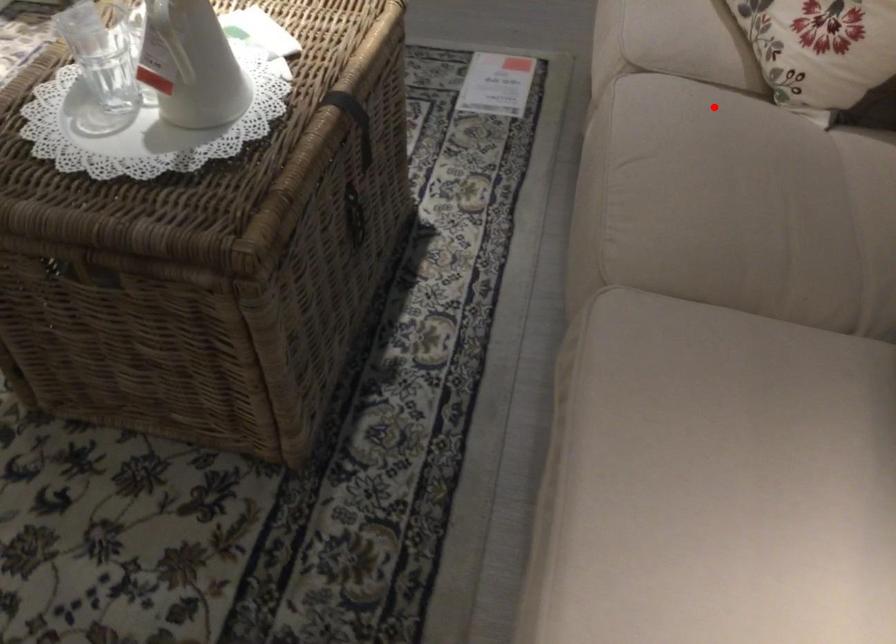
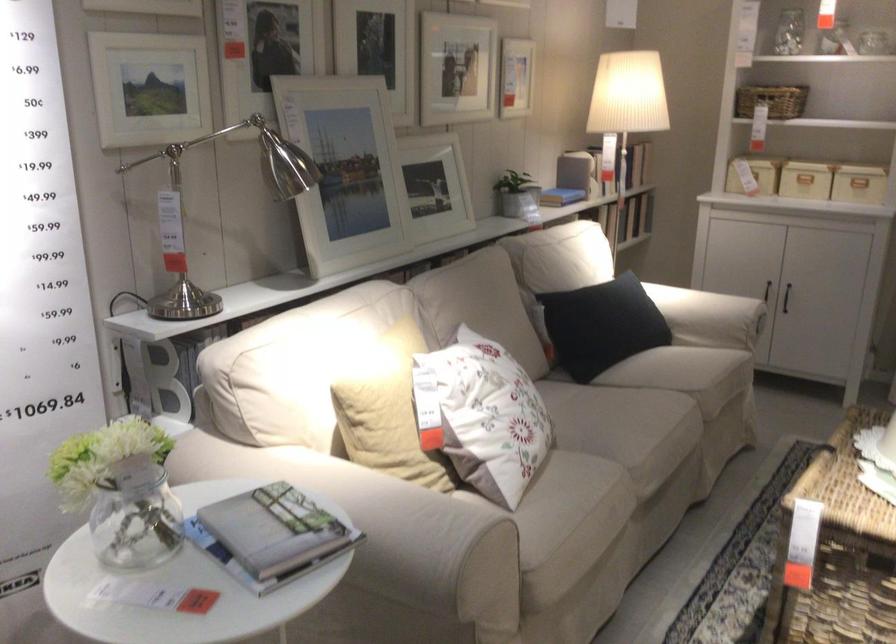
Question: A red point is marked in image1. In image2, is the corresponding 3D point closer to the camera or farther? Reply with the corresponding letter.

Choices:
 (A) The corresponding 3D point is closer.
 (B) The corresponding 3D point is farther.

Answer: (B)